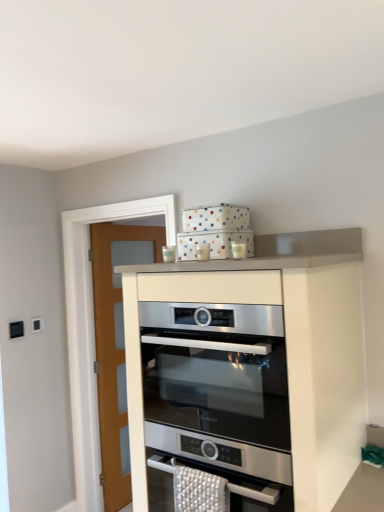
Question: From the image's perspective, is stainless steel oven at center located above or below satin white oven at upper center?

Choices:
 (A) above
 (B) below

Answer: (A)

Question: Is stainless steel oven at center taller or shorter than satin white oven at upper center?

Choices:
 (A) short
 (B) tall

Answer: (A)

Question: Relative to satin white oven at upper center, is stainless steel oven at center in front or behind?

Choices:
 (A) front
 (B) behind

Answer: (B)

Question: Is satin white oven at upper center bigger or smaller than stainless steel oven at center?

Choices:
 (A) big
 (B) small

Answer: (A)

Question: From their relative heights in the image, would you say satin white oven at upper center is taller or shorter than stainless steel oven at center?

Choices:
 (A) short
 (B) tall

Answer: (B)

Question: Looking at their shapes, would you say satin white oven at upper center is wider or thinner than stainless steel oven at center?

Choices:
 (A) wide
 (B) thin

Answer: (B)

Question: In the image, is satin white oven at upper center positioned in front of or behind stainless steel oven at center?

Choices:
 (A) front
 (B) behind

Answer: (A)